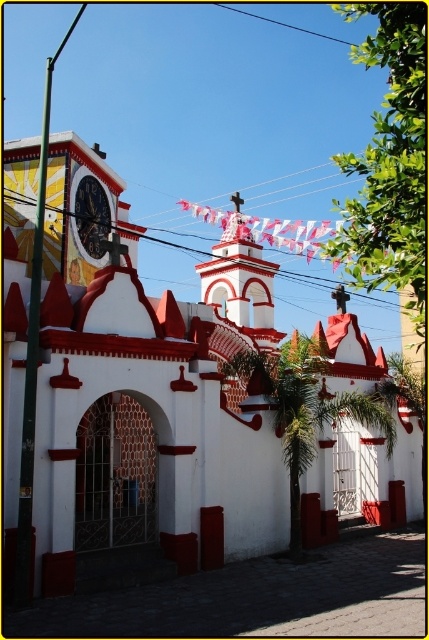
Does black wire at upper center have a smaller size compared to metallic clock face at upper left?

Incorrect, black wire at upper center is not smaller in size than metallic clock face at upper left.

Who is more forward, (145, 234) or (97, 253)?

Point (97, 253) is more forward.

Where is `black wire at upper center`? This screenshot has width=429, height=640. black wire at upper center is located at coordinates (159, 241).

Is point (247, 296) in front of point (147, 237)?

Yes.

Based on the photo, can you confirm if white painted stucco bell tower at center is thinner than black wire at upper center?

Correct, white painted stucco bell tower at center's width is less than black wire at upper center's.

Identify the location of white painted stucco bell tower at center. This screenshot has height=640, width=429. (238, 275).

The width and height of the screenshot is (429, 640). What are the coordinates of `white painted stucco bell tower at center` in the screenshot? It's located at (238, 275).

Which of these two, white matte church at center or metallic clock face at upper left, stands taller?

white matte church at center

How far apart are white matte church at center and metallic clock face at upper left?

white matte church at center and metallic clock face at upper left are 49.84 feet apart.

The width and height of the screenshot is (429, 640). What are the coordinates of `white matte church at center` in the screenshot? It's located at (148, 403).

I want to click on white matte church at center, so click(148, 403).